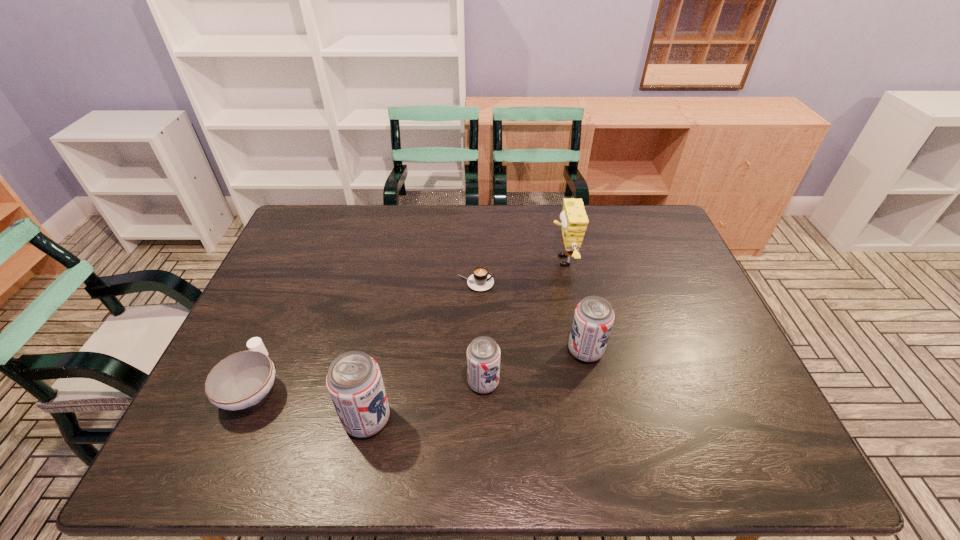
The image size is (960, 540). I want to click on free space between the second shortest beer can and the cappuccino, so click(x=531, y=316).

This screenshot has width=960, height=540. In order to click on vacant space in between the second object from left to right and the leftmost object in this screenshot , I will do `click(310, 403)`.

You are a GUI agent. You are given a task and a screenshot of the screen. Output one action in this format:
    pyautogui.click(x=<x>, y=<y>)
    Task: Click on the empty space between the sponge and the rightmost beer can
    The height and width of the screenshot is (540, 960).
    Given the screenshot: What is the action you would take?
    574,306

Find the location of a particular element. Image resolution: width=960 pixels, height=540 pixels. vacant region between the third shortest object and the nearest beer can is located at coordinates 425,401.

Find the location of `empty space that is in between the fifth object from right to left and the cappuccino`. empty space that is in between the fifth object from right to left and the cappuccino is located at coordinates (421, 350).

Find the location of a particular element. The height and width of the screenshot is (540, 960). blank region between the second nearest beer can and the farthest beer can is located at coordinates (535, 367).

Find the location of a particular element. free space between the sponge and the leftmost beer can is located at coordinates (465, 340).

Image resolution: width=960 pixels, height=540 pixels. Find the location of `free spot between the leftmost object and the shortest object`. free spot between the leftmost object and the shortest object is located at coordinates (365, 335).

Image resolution: width=960 pixels, height=540 pixels. What are the coordinates of `the third closest object relative to the chinaware` in the screenshot? It's located at (480, 280).

You are a GUI agent. You are given a task and a screenshot of the screen. Output one action in this format:
    pyautogui.click(x=<x>, y=<y>)
    Task: Click on the fifth closest object relative to the fifth tallest object
    
    Given the screenshot: What is the action you would take?
    pyautogui.click(x=574, y=220)